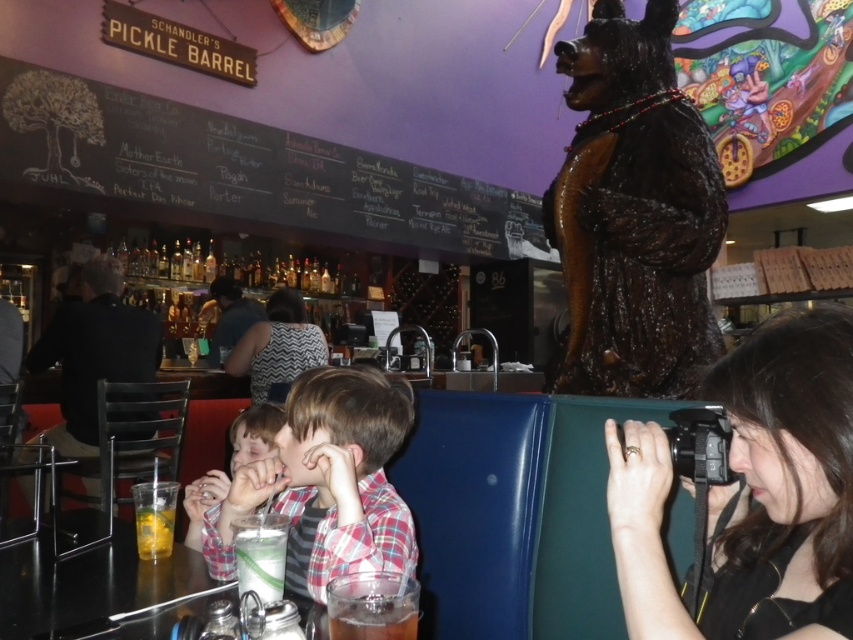
You are a bartender at Schandler s Pickle Barrel and you need to place a new drink order on the counter. The plaid shirt at center and the translucent plastic cup at lower center are in your way. Which object should you move first to make space?

You should move the plaid shirt at center first because it is closer to you than the translucent plastic cup at lower center, so you can access the cup afterward.

You are a photographer standing at the entrance of Schandler s Pickle Barrel bar. You want to take a photo of the smooth skin child at center so that they are centered in the frame. Based on their current position, which direction should you move to position yourself directly in front of them?

The smooth skin child at center is located at point 0.678 on the x axis and 0.299 on the y axis. To center them in your photo, you should move to the left along the x axis and down along the y axis to align with their position.

You are a customer at Schandler Pickle Barrel and want to move from the entrance to the bar counter. There are two points marked as point (x=320, y=227) and point (x=283, y=484). Which point should you pass through first?

Point (x=283, y=484) should be passed through first because point (x=320, y=227) is behind it.